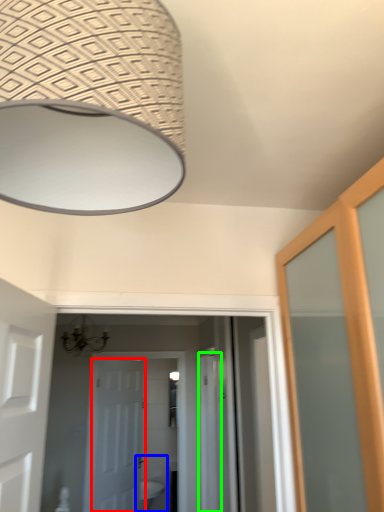
Question: Based on their relative distances, which object is nearer to door (highlighted by a red box)? Choose from sink (highlighted by a blue box) and screen door (highlighted by a green box).

Choices:
 (A) sink
 (B) screen door

Answer: (A)